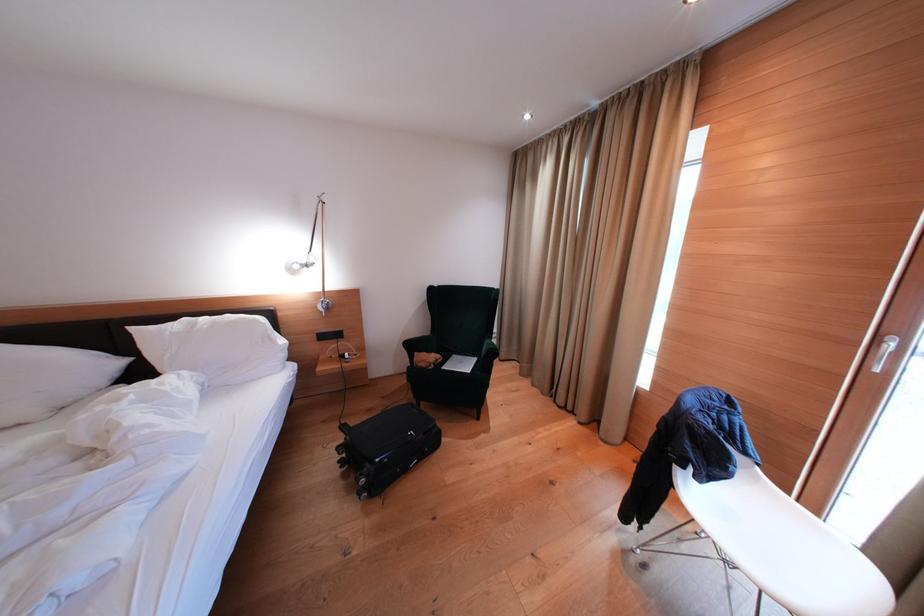
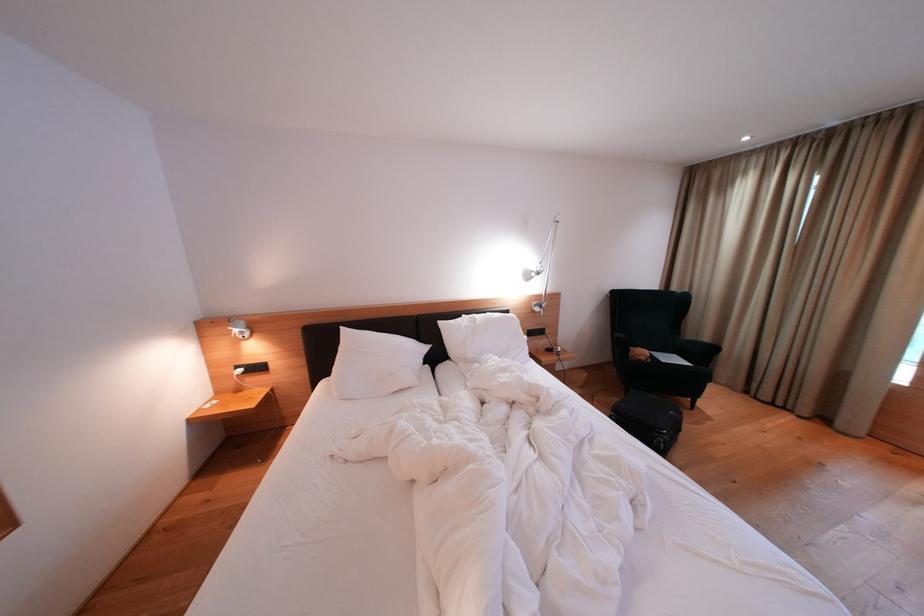
The point at (374, 469) is marked in the first image. Where is the corresponding point in the second image?

(664, 439)